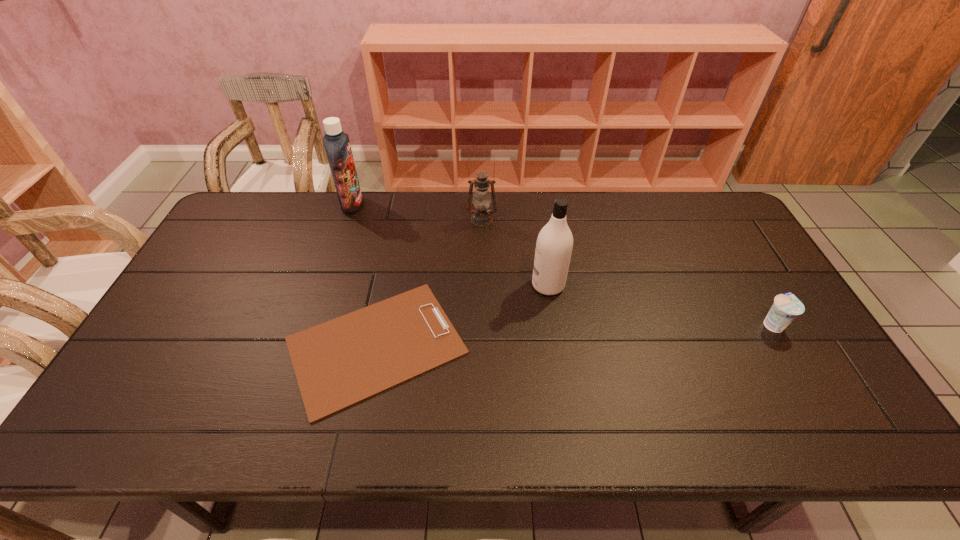
At what (x,y) coordinates should I click in order to perform the action: click on vacant position at the left edge of the desktop. Please return your answer as a coordinate pair (x, y). This screenshot has width=960, height=540. Looking at the image, I should click on (165, 314).

Locate an element on the screen. free space between the oil lamp and the nearer shampoo is located at coordinates (515, 252).

The image size is (960, 540). I want to click on vacant area between the fourth object from left to right and the oil lamp, so click(515, 252).

Find the location of `free point between the oil lamp and the yogurt`. free point between the oil lamp and the yogurt is located at coordinates (627, 272).

Identify the location of unoccupied position between the farther shampoo and the fourth object from left to right. Image resolution: width=960 pixels, height=540 pixels. (450, 245).

You are a GUI agent. You are given a task and a screenshot of the screen. Output one action in this format:
    pyautogui.click(x=<x>, y=<y>)
    Task: Click on the vacant area that lies between the oil lamp and the left shampoo
    
    Given the screenshot: What is the action you would take?
    pyautogui.click(x=417, y=212)

The image size is (960, 540). Identify the location of free spot between the clipboard and the left shampoo. (364, 275).

This screenshot has height=540, width=960. I want to click on vacant area that lies between the second object from right to left and the rightmost object, so click(660, 305).

The image size is (960, 540). What are the coordinates of `empty space between the second shortest object and the oil lamp` in the screenshot? It's located at (627, 272).

You are a GUI agent. You are given a task and a screenshot of the screen. Output one action in this format:
    pyautogui.click(x=<x>, y=<y>)
    Task: Click on the unoccupied area between the oil lamp and the farther shampoo
    Image resolution: width=960 pixels, height=540 pixels.
    Given the screenshot: What is the action you would take?
    (x=417, y=212)